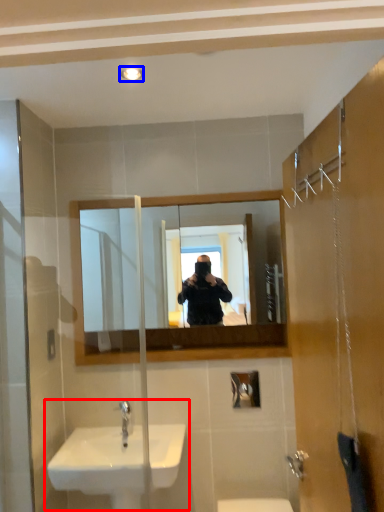
Question: Which of the following is the closest to the observer, sink (highlighted by a red box) or light fixture (highlighted by a blue box)?

Choices:
 (A) sink
 (B) light fixture

Answer: (B)